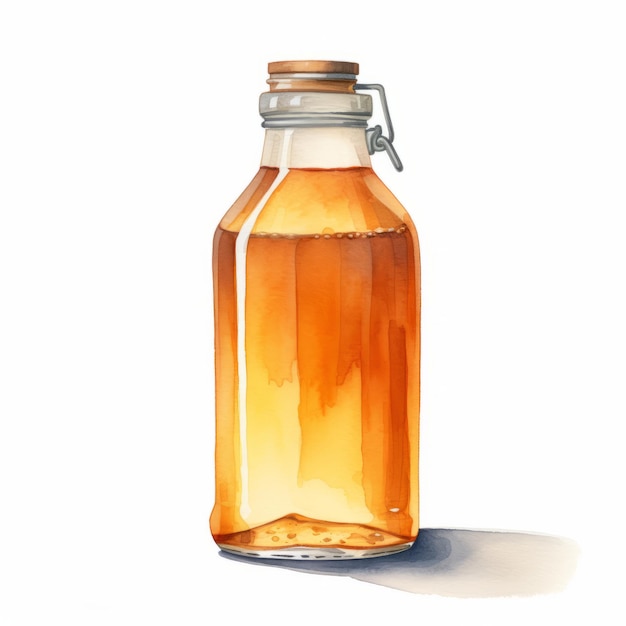
Locate an element on the screen. The width and height of the screenshot is (626, 626). cork is located at coordinates (299, 67).